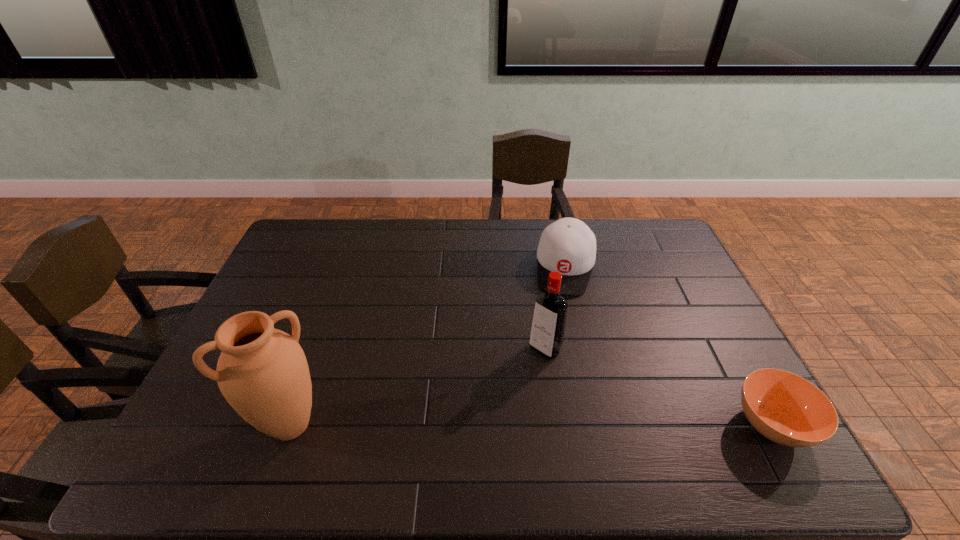
What are the coordinates of `blank region between the rightmost object and the tallest object` in the screenshot? It's located at (532, 425).

Find the location of a particular element. empty space that is in between the rightmost object and the farthest object is located at coordinates (669, 346).

Where is `vacant space that's between the soup bowl and the urn`? This screenshot has width=960, height=540. vacant space that's between the soup bowl and the urn is located at coordinates (532, 425).

In order to click on blank region between the third tallest object and the shortest object in this screenshot , I will do `click(669, 346)`.

Find the location of a particular element. The height and width of the screenshot is (540, 960). vacant point located between the third shortest object and the leftmost object is located at coordinates (418, 387).

Find the location of a particular element. object identified as the closest to the urn is located at coordinates (548, 325).

Locate which object ranks second in proximity to the urn. Please provide its 2D coordinates. Your answer should be formatted as a tuple, i.e. [(x, y)], where the tuple contains the x and y coordinates of a point satisfying the conditions above.

[(568, 246)]

The image size is (960, 540). Find the location of `vacant region that satisfies the following two spatial constraints: 1. on the back side of the second tallest object; 2. on the right side of the baseball cap`. vacant region that satisfies the following two spatial constraints: 1. on the back side of the second tallest object; 2. on the right side of the baseball cap is located at coordinates point(534,268).

Identify the location of free space that satisfies the following two spatial constraints: 1. on the front side of the baseball cap; 2. on the left side of the rightmost object. (601, 425).